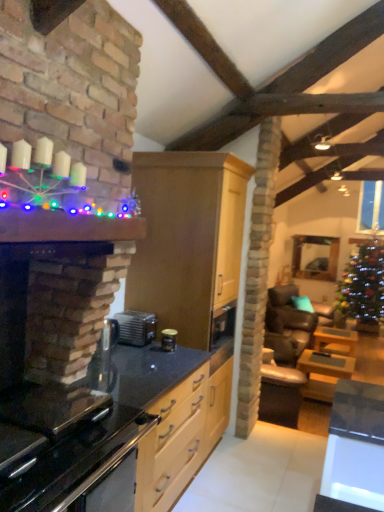
Question: Is wooden table at right, marked as the 3th table in a back-to-front arrangement, positioned before clear glass door at upper right?

Choices:
 (A) yes
 (B) no

Answer: (A)

Question: Considering the relative sizes of wooden table at right, which is the 1th table from left to right, and clear glass door at upper right in the image provided, is wooden table at right, which is the 1th table from left to right, thinner than clear glass door at upper right?

Choices:
 (A) yes
 (B) no

Answer: (B)

Question: Is wooden table at right, which appears as the third table when viewed from the right, oriented away from clear glass door at upper right?

Choices:
 (A) yes
 (B) no

Answer: (B)

Question: Is wooden table at right, which is the 1th table from left to right, to the left of clear glass door at upper right from the viewer's perspective?

Choices:
 (A) no
 (B) yes

Answer: (B)

Question: From the image's perspective, is wooden table at right, marked as the 3th table in a back-to-front arrangement, below clear glass door at upper right?

Choices:
 (A) yes
 (B) no

Answer: (A)

Question: From the image's perspective, is yellow wood table at lower right, the 1th table positioned from the back, positioned above or below light wood cabinet at center?

Choices:
 (A) below
 (B) above

Answer: (A)

Question: Do you think yellow wood table at lower right, placed as the first table when sorted from right to left, is within light wood cabinet at center, or outside of it?

Choices:
 (A) outside
 (B) inside

Answer: (A)

Question: Considering the positions of yellow wood table at lower right, the 1th table positioned from the back, and light wood cabinet at center in the image, is yellow wood table at lower right, the 1th table positioned from the back, taller or shorter than light wood cabinet at center?

Choices:
 (A) tall
 (B) short

Answer: (B)

Question: From a real-world perspective, is yellow wood table at lower right, placed as the first table when sorted from right to left, above or below light wood cabinet at center?

Choices:
 (A) below
 (B) above

Answer: (A)

Question: Looking at the image, does green glittering christmas tree at right seem bigger or smaller compared to wooden table at right, which is the 1th table from left to right?

Choices:
 (A) small
 (B) big

Answer: (B)

Question: Would you say green glittering christmas tree at right is to the left or to the right of wooden table at right, which appears as the third table when viewed from the right, in the picture?

Choices:
 (A) right
 (B) left

Answer: (A)

Question: In terms of height, does green glittering christmas tree at right look taller or shorter compared to wooden table at right, marked as the 3th table in a back-to-front arrangement?

Choices:
 (A) short
 (B) tall

Answer: (B)

Question: Considering the positions of green glittering christmas tree at right and wooden table at right, which is the 1th table from left to right, in the image, is green glittering christmas tree at right wider or thinner than wooden table at right, which is the 1th table from left to right,?

Choices:
 (A) thin
 (B) wide

Answer: (B)

Question: From the image's perspective, is satin silver toaster at center, which appears as the first appliance when viewed from the left, located above or below black glass oven at lower left?

Choices:
 (A) below
 (B) above

Answer: (B)

Question: In terms of height, does satin silver toaster at center, which appears as the first appliance when viewed from the left, look taller or shorter compared to black glass oven at lower left?

Choices:
 (A) short
 (B) tall

Answer: (A)